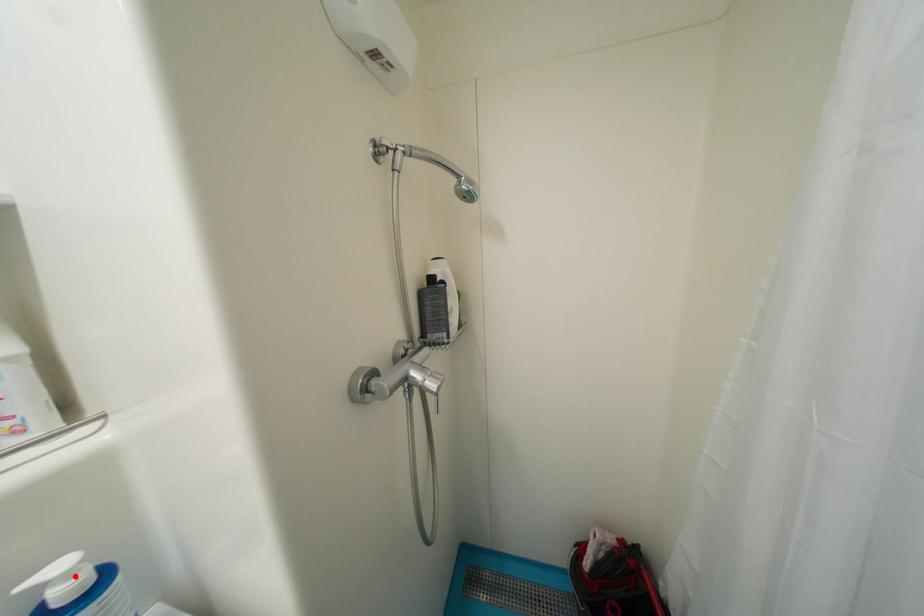
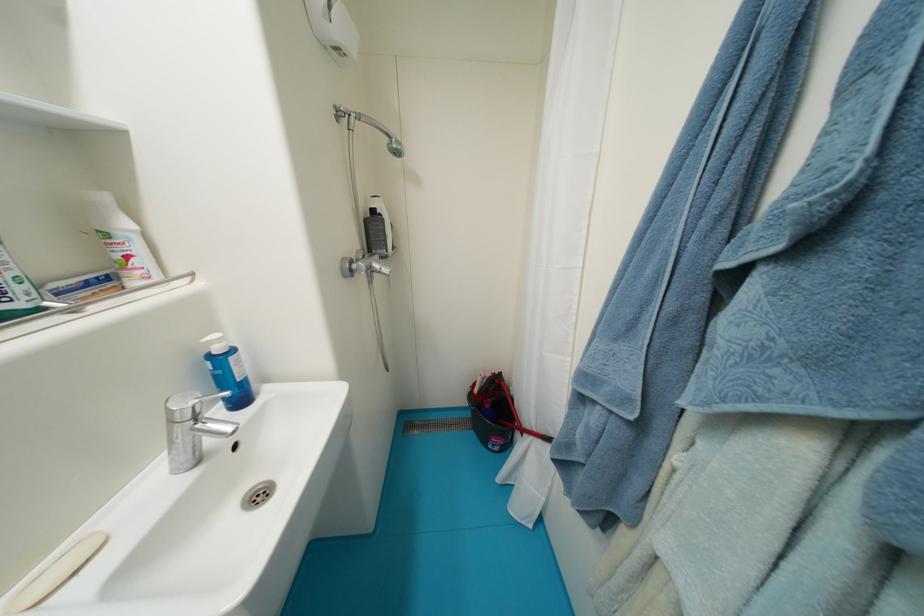
Locate, in the second image, the point that corresponds to the highlighted location in the first image.

(225, 342)